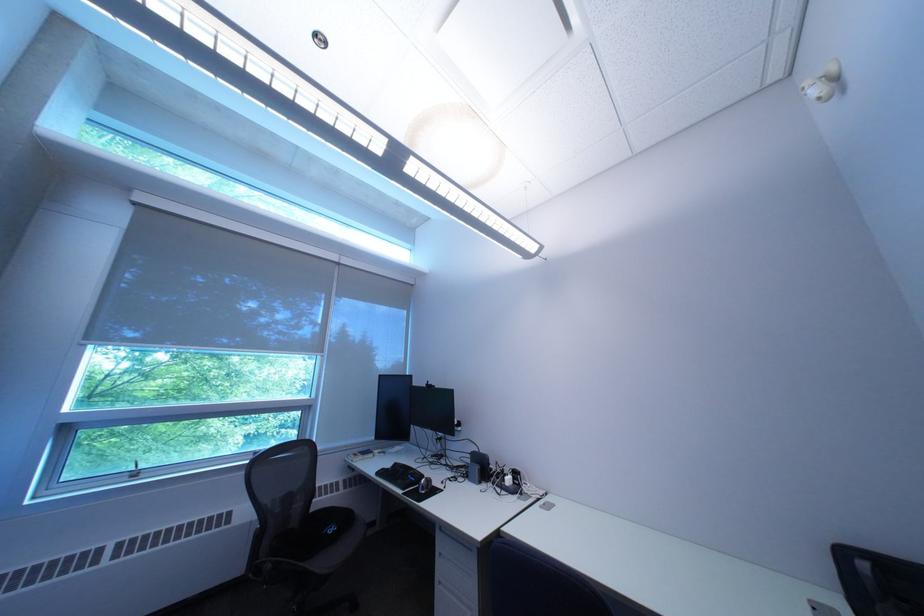
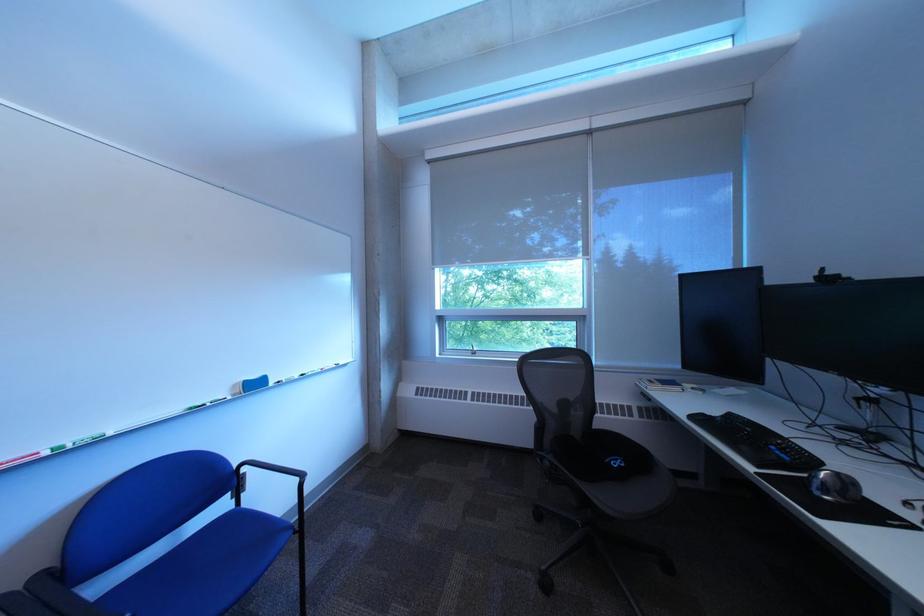
Question: The camera is either moving clockwise (left) or counter-clockwise (right) around the object. The first image is from the beginning of the video and the second image is from the end. Is the camera moving left or right when shooting the video?

Choices:
 (A) Left
 (B) Right

Answer: (B)